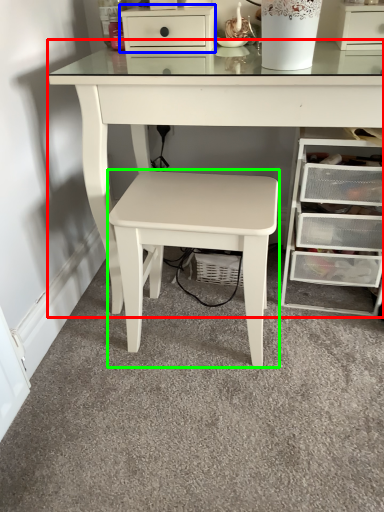
Question: Based on their relative distances, which object is farther from table (highlighted by a red box)? Choose from chest of drawers (highlighted by a blue box) and stool (highlighted by a green box).

Choices:
 (A) chest of drawers
 (B) stool

Answer: (A)